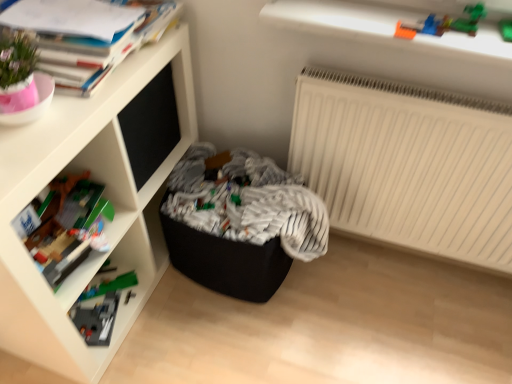
Identify the location of empty space that is ontop of white matte radiator at upper right (from a real-world perspective). This screenshot has height=384, width=512. (412, 98).